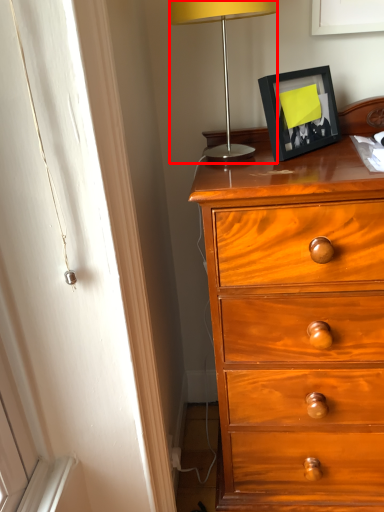
Question: From the image's perspective, what is the correct spatial relationship of lamp (annotated by the red box) in relation to picture frame?

Choices:
 (A) below
 (B) above

Answer: (B)